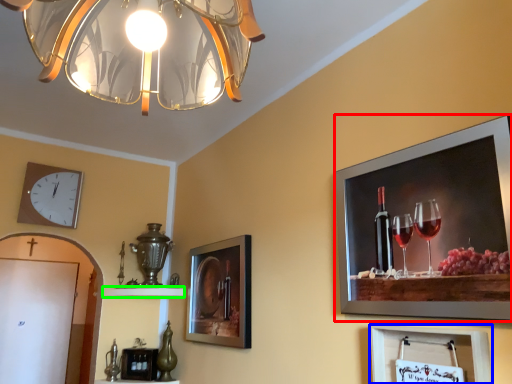
Question: Which is farther away from picture frame (highlighted by a red box)? picture frame (highlighted by a blue box) or shelf (highlighted by a green box)?

Choices:
 (A) picture frame
 (B) shelf

Answer: (B)